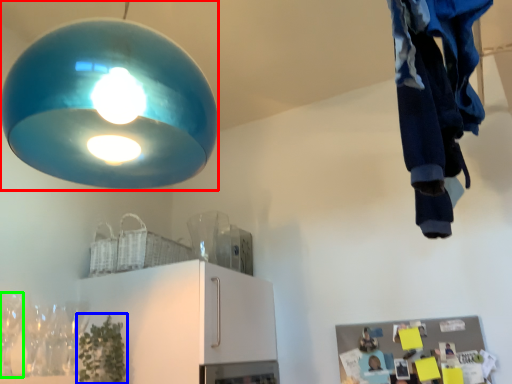
Question: Which object is positioned closest to lamp (highlighted by a red box)? Select from plant (highlighted by a blue box) and wine glass (highlighted by a green box).

Choices:
 (A) plant
 (B) wine glass

Answer: (B)